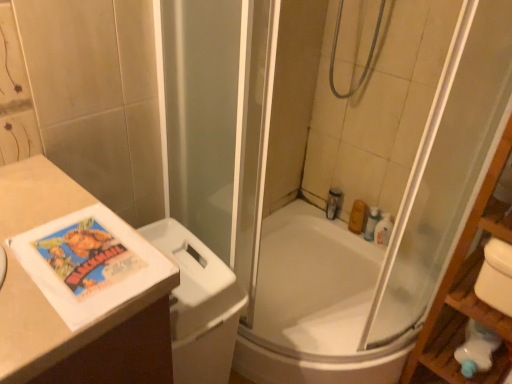
Question: Is white plastic bottle at upper right, which is the 3th toiletry from left to right, to the left of wooden shelf at right from the viewer's perspective?

Choices:
 (A) yes
 (B) no

Answer: (A)

Question: Considering the relative sizes of white plastic bottle at upper right, the 2th toiletry when ordered from right to left, and wooden shelf at right in the image provided, is white plastic bottle at upper right, the 2th toiletry when ordered from right to left, shorter than wooden shelf at right?

Choices:
 (A) yes
 (B) no

Answer: (A)

Question: Considering the relative sizes of white plastic bottle at upper right, the 2th toiletry when ordered from right to left, and wooden shelf at right in the image provided, is white plastic bottle at upper right, the 2th toiletry when ordered from right to left, bigger than wooden shelf at right?

Choices:
 (A) no
 (B) yes

Answer: (A)

Question: Are white plastic bottle at upper right, the 2th toiletry when ordered from right to left, and wooden shelf at right beside each other?

Choices:
 (A) no
 (B) yes

Answer: (A)

Question: Considering the relative sizes of white plastic bottle at upper right, which is the 3th toiletry from left to right, and wooden shelf at right in the image provided, is white plastic bottle at upper right, which is the 3th toiletry from left to right, smaller than wooden shelf at right?

Choices:
 (A) yes
 (B) no

Answer: (A)

Question: Is point click(362, 225) closer or farther from the camera than point click(504, 205)?

Choices:
 (A) farther
 (B) closer

Answer: (A)

Question: From a real-world perspective, is orange matte soap at upper right, which appears as the third toiletry when viewed from the right, positioned above or below wooden shelf at right?

Choices:
 (A) above
 (B) below

Answer: (B)

Question: Which is correct: orange matte soap at upper right, which appears as the third toiletry when viewed from the right, is inside wooden shelf at right, or outside of it?

Choices:
 (A) inside
 (B) outside

Answer: (B)

Question: Is orange matte soap at upper right, which is counted as the second toiletry, starting from the left, bigger or smaller than wooden shelf at right?

Choices:
 (A) small
 (B) big

Answer: (A)

Question: Is point (501, 218) positioned closer to the camera than point (392, 218)?

Choices:
 (A) closer
 (B) farther

Answer: (A)

Question: Considering their positions, is wooden shelf at right located in front of or behind translucent plastic soap at upper right, placed as the fourth toiletry when sorted from left to right?

Choices:
 (A) front
 (B) behind

Answer: (A)

Question: From a real-world perspective, relative to translucent plastic soap at upper right, placed as the 1th toiletry when sorted from right to left, is wooden shelf at right vertically above or below?

Choices:
 (A) above
 (B) below

Answer: (A)

Question: From the image's perspective, is wooden shelf at right positioned above or below translucent plastic soap at upper right, placed as the fourth toiletry when sorted from left to right?

Choices:
 (A) below
 (B) above

Answer: (A)

Question: Does point (369, 218) appear closer or farther from the camera than point (229, 279)?

Choices:
 (A) farther
 (B) closer

Answer: (A)

Question: Is white plastic bottle at upper right, which is the 3th toiletry from left to right, to the left or to the right of white plastic toilet bowl at left in the image?

Choices:
 (A) right
 (B) left

Answer: (A)